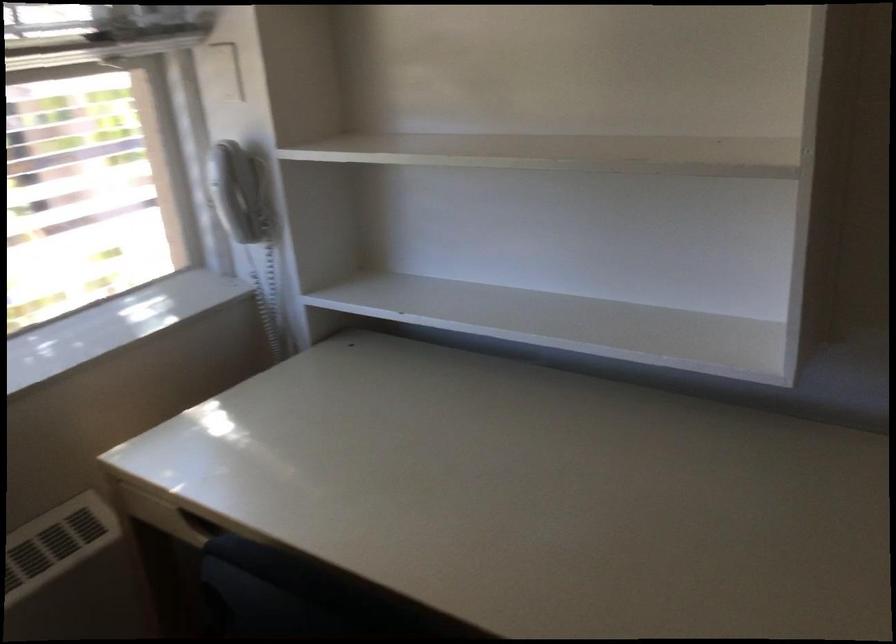
Where is `telephone handset`? telephone handset is located at coordinates (230, 190).